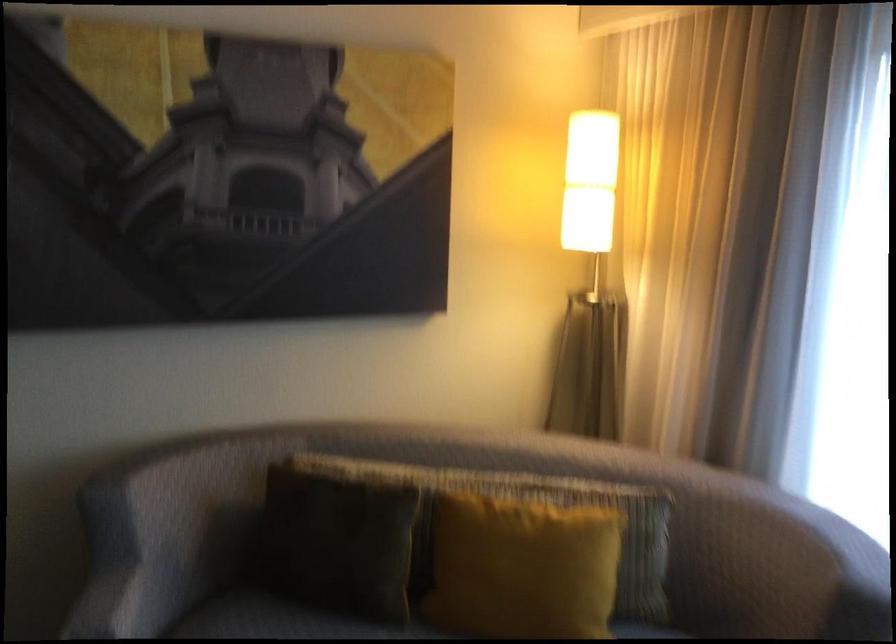
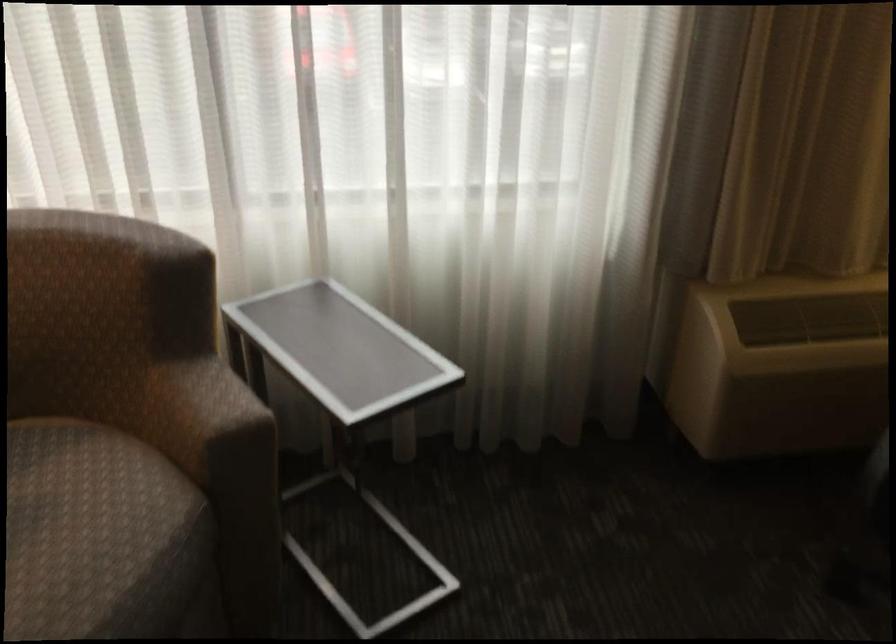
In the scene shown: Based on the continuous images, in which direction is the camera rotating?

The camera rotated toward right-down.